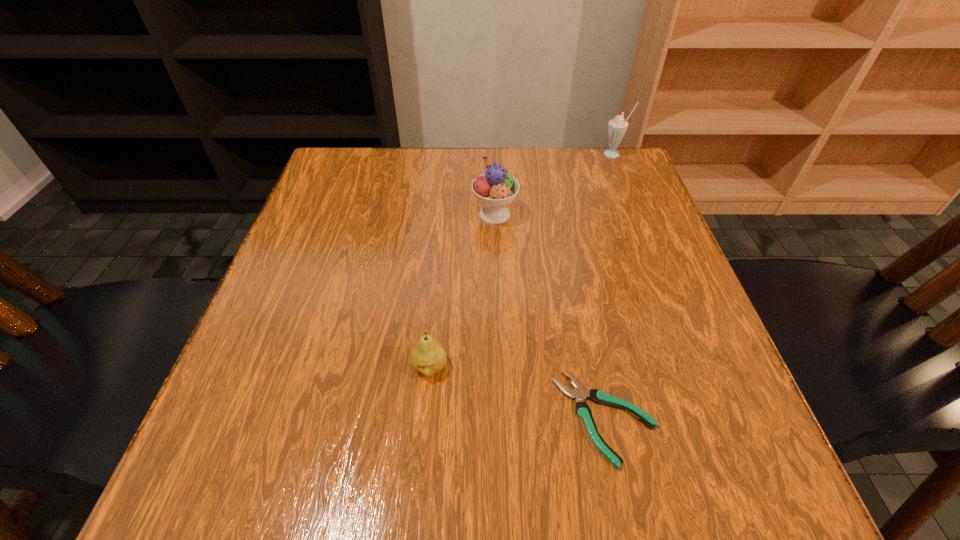
This screenshot has height=540, width=960. Find the location of `vacant space situated on the right of the second shortest object`. vacant space situated on the right of the second shortest object is located at coordinates [534, 367].

The height and width of the screenshot is (540, 960). What are the coordinates of `vacant space positioned 0.170m on the back of the shortest object` in the screenshot? It's located at (580, 293).

The height and width of the screenshot is (540, 960). Find the location of `milkshake located at the far edge`. milkshake located at the far edge is located at coordinates (617, 127).

This screenshot has width=960, height=540. In order to click on icecream that is at the far edge in this screenshot , I will do `click(496, 189)`.

Identify the location of object that is at the near edge. The image size is (960, 540). (582, 409).

Locate an element on the screen. The image size is (960, 540). milkshake present at the right edge is located at coordinates (617, 127).

Where is `pliers that is at the right edge`? Image resolution: width=960 pixels, height=540 pixels. pliers that is at the right edge is located at coordinates (582, 409).

I want to click on object at the far right corner, so click(617, 127).

Locate an element on the screen. The width and height of the screenshot is (960, 540). object that is at the near right corner is located at coordinates (582, 409).

In the image, there is a desktop. Where is `free region at the far edge`? Image resolution: width=960 pixels, height=540 pixels. free region at the far edge is located at coordinates (549, 148).